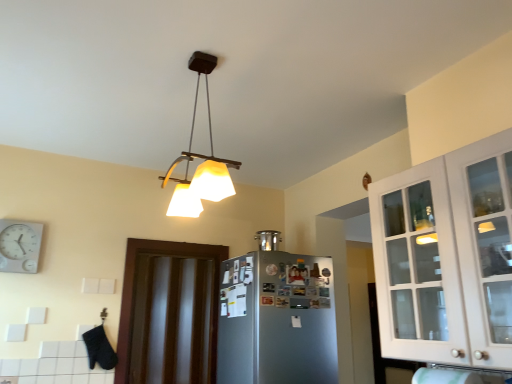
Question: Is there a large distance between matte white lampshade at upper center and dark wood door at center?

Choices:
 (A) no
 (B) yes

Answer: (A)

Question: Is matte white lampshade at upper center smaller than dark wood door at center?

Choices:
 (A) no
 (B) yes

Answer: (A)

Question: Is matte white lampshade at upper center bigger than dark wood door at center?

Choices:
 (A) yes
 (B) no

Answer: (A)

Question: Can you see matte white lampshade at upper center touching dark wood door at center?

Choices:
 (A) yes
 (B) no

Answer: (B)

Question: Is matte white lampshade at upper center positioned beyond the bounds of dark wood door at center?

Choices:
 (A) yes
 (B) no

Answer: (A)

Question: From a real-world perspective, is satin silver refrigerator at center positioned above or below white glass cabinet at upper right?

Choices:
 (A) above
 (B) below

Answer: (B)

Question: Is satin silver refrigerator at center in front of or behind white glass cabinet at upper right in the image?

Choices:
 (A) behind
 (B) front

Answer: (A)

Question: Would you say satin silver refrigerator at center is inside or outside white glass cabinet at upper right?

Choices:
 (A) inside
 (B) outside

Answer: (B)

Question: In the image, is satin silver refrigerator at center on the left side or the right side of white glass cabinet at upper right?

Choices:
 (A) right
 (B) left

Answer: (B)

Question: From a real-world perspective, relative to dark wood door at center, is satin silver pot at upper center vertically above or below?

Choices:
 (A) above
 (B) below

Answer: (A)

Question: From the image's perspective, is satin silver pot at upper center above or below dark wood door at center?

Choices:
 (A) above
 (B) below

Answer: (A)

Question: Considering the positions of point (265, 230) and point (173, 268), is point (265, 230) closer or farther from the camera than point (173, 268)?

Choices:
 (A) closer
 (B) farther

Answer: (B)

Question: Relative to dark wood door at center, is satin silver pot at upper center in front or behind?

Choices:
 (A) behind
 (B) front

Answer: (A)

Question: From their relative heights in the image, would you say matte white lampshade at upper center is taller or shorter than satin silver pot at upper center?

Choices:
 (A) tall
 (B) short

Answer: (A)

Question: Considering the positions of matte white lampshade at upper center and satin silver pot at upper center in the image, is matte white lampshade at upper center bigger or smaller than satin silver pot at upper center?

Choices:
 (A) big
 (B) small

Answer: (A)